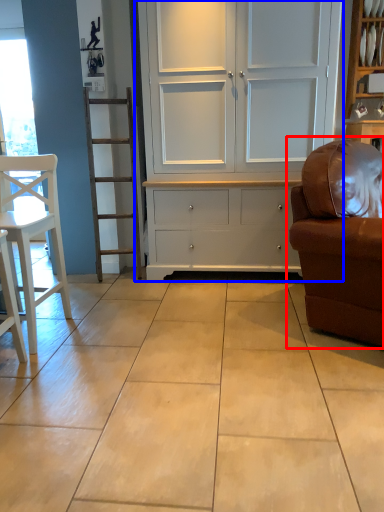
Question: Among these objects, which one is nearest to the camera, studio couch (highlighted by a red box) or cupboard (highlighted by a blue box)?

Choices:
 (A) studio couch
 (B) cupboard

Answer: (A)